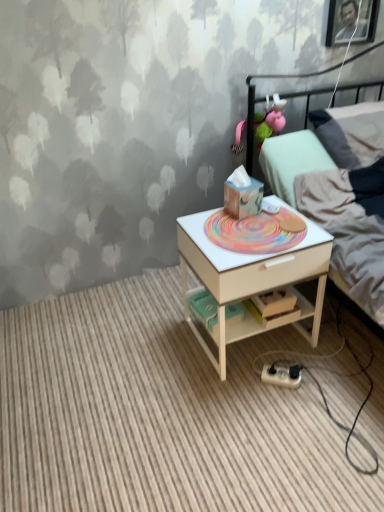
Image resolution: width=384 pixels, height=512 pixels. Identify the location of vacant space to the left of white plastic power strip at lower center. (240, 385).